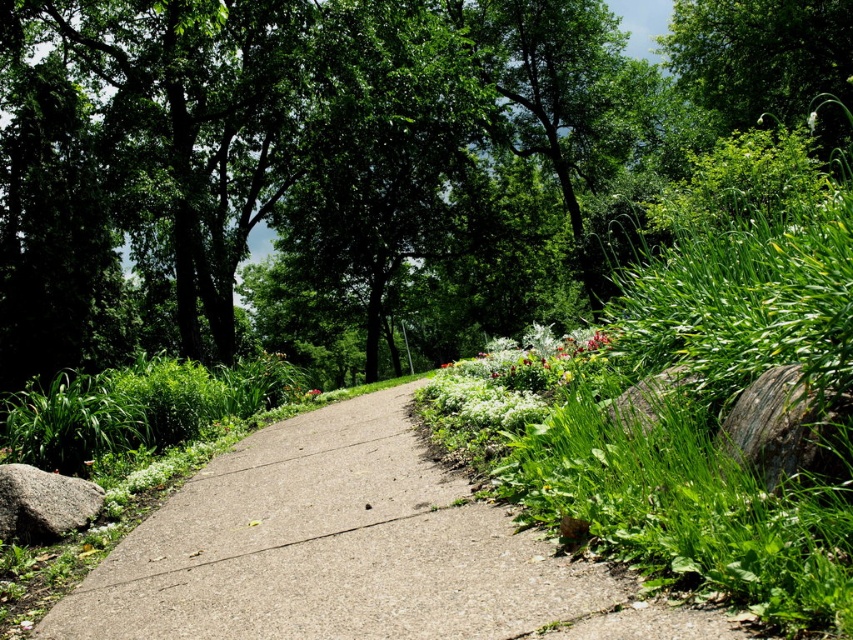
Question: Where is white matte flowers at center located in relation to gray rough rock at lower left in the image?

Choices:
 (A) left
 (B) right

Answer: (B)

Question: Is white matte flowers at center smaller than green matte flower at center?

Choices:
 (A) no
 (B) yes

Answer: (A)

Question: Does gray rough rock at lower right have a greater width compared to green matte flower at center?

Choices:
 (A) yes
 (B) no

Answer: (B)

Question: Estimate the real-world distances between objects in this image. Which object is farther from the white matte flowers at center?

Choices:
 (A) gray concrete pavement at center
 (B) green matte flower at center
 (C) gray rough rock at right

Answer: (A)

Question: Which object is the farthest from the gray rough rock at lower right?

Choices:
 (A) gray concrete pavement at center
 (B) gray rough rock at right

Answer: (A)

Question: Which of the following is the farthest from the observer?

Choices:
 (A) (318, 394)
 (B) (39, 476)

Answer: (A)